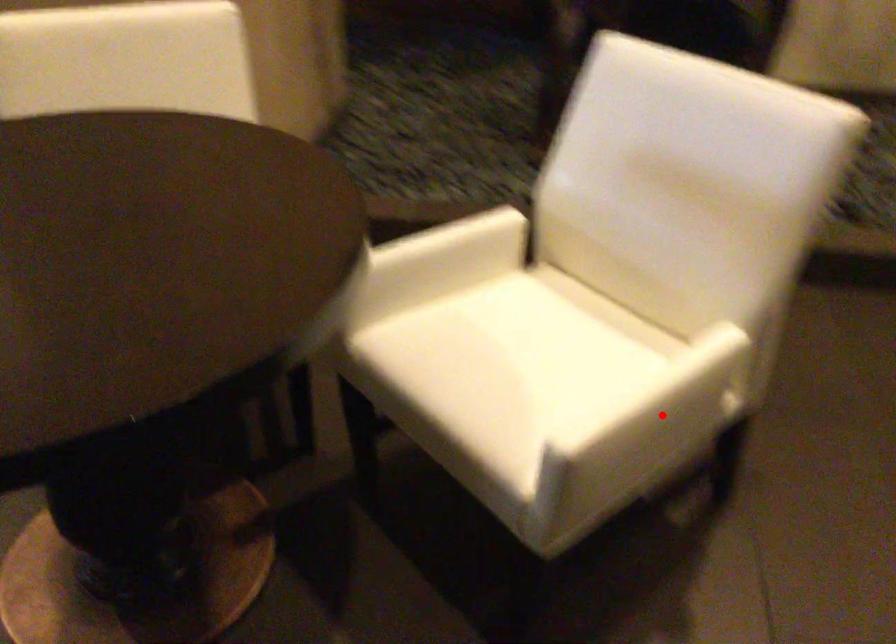
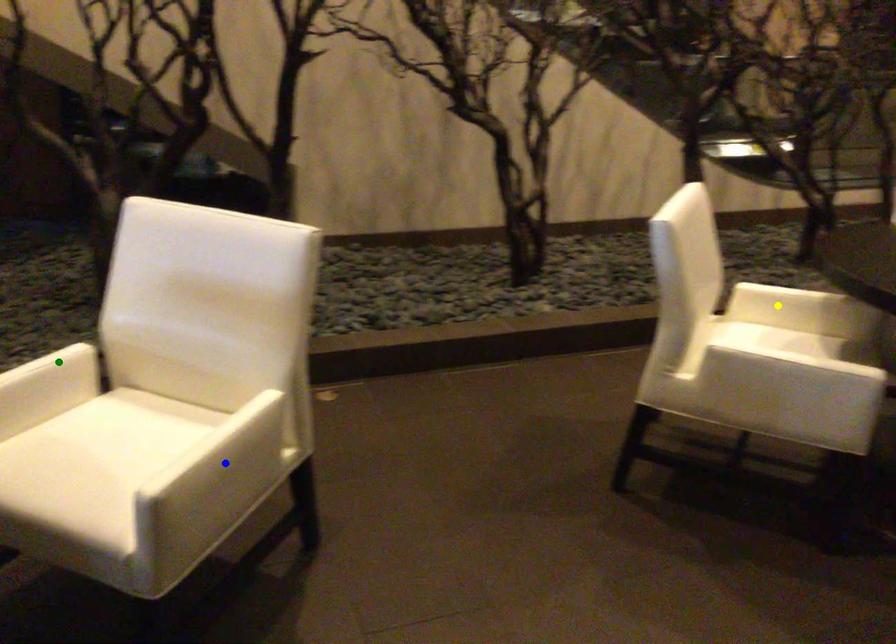
Question: I am providing you with two images of the same scene from different viewpoints. A red point is marked on the first image. You are given multiple points on the second image. Can you choose the point in image 2 that corresponds to the point in image 1?

Choices:
 (A) blue point
 (B) yellow point
 (C) green point

Answer: (A)